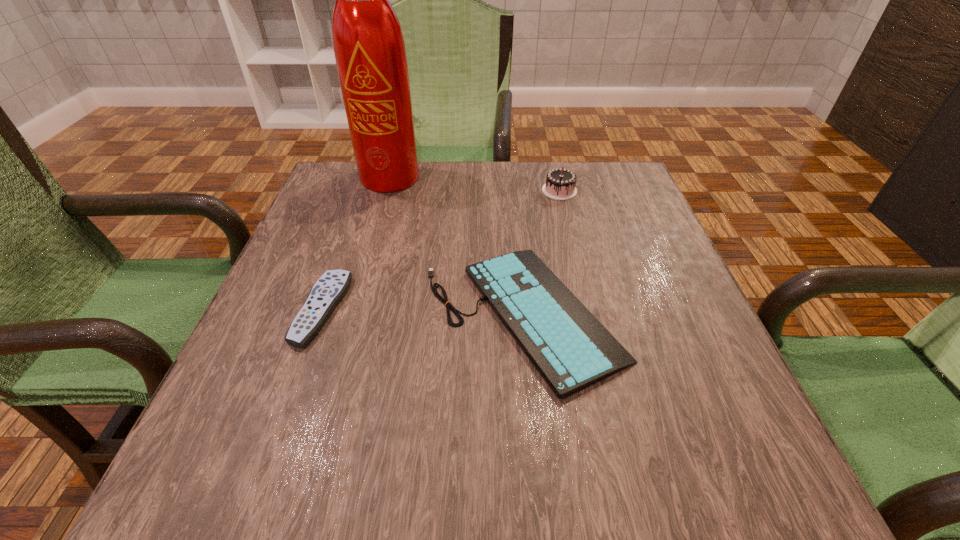
Identify the location of fire extinguisher that is at the left edge. (369, 48).

Identify the location of remote control located at the left edge. (330, 288).

Identify the location of object present at the right edge. The image size is (960, 540). click(571, 349).

At what (x,y) coordinates should I click in order to perform the action: click on object that is at the far left corner. Please return your answer as a coordinate pair (x, y). The width and height of the screenshot is (960, 540). Looking at the image, I should click on (369, 48).

Locate an element on the screen. Image resolution: width=960 pixels, height=540 pixels. vacant space at the far edge is located at coordinates (492, 169).

The image size is (960, 540). I want to click on free space at the near edge of the desktop, so click(x=408, y=462).

In the image, there is a desktop. At what (x,y) coordinates should I click in order to perform the action: click on vacant space at the left edge. Please return your answer as a coordinate pair (x, y). The width and height of the screenshot is (960, 540). Looking at the image, I should click on (315, 214).

The width and height of the screenshot is (960, 540). I want to click on vacant space at the right edge, so click(x=620, y=230).

The width and height of the screenshot is (960, 540). What are the coordinates of `vacant space at the far left corner of the desktop` in the screenshot? It's located at (348, 207).

Where is `vacant space at the far right corner`? vacant space at the far right corner is located at coordinates (575, 167).